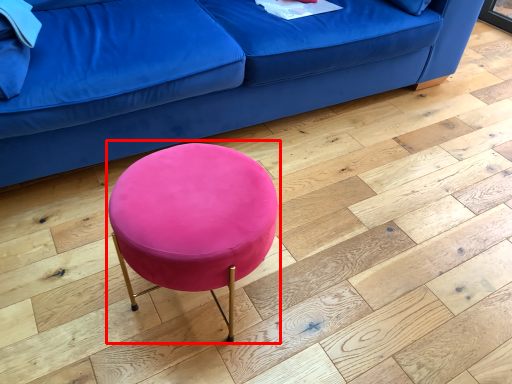
Question: From the image's perspective, considering the relative positions of bar stool (annotated by the red box) and studio couch in the image provided, where is bar stool (annotated by the red box) located with respect to the staircase?

Choices:
 (A) below
 (B) above

Answer: (A)